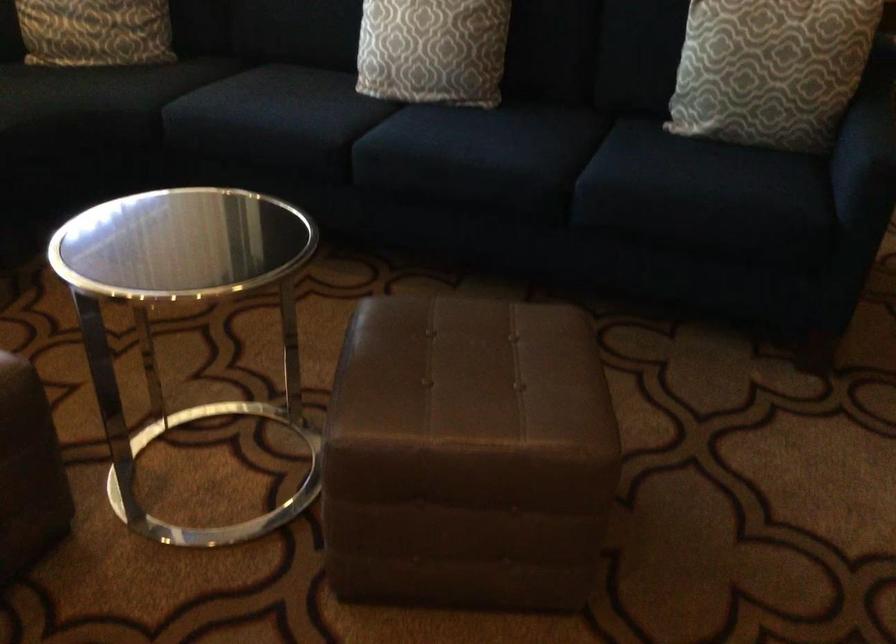
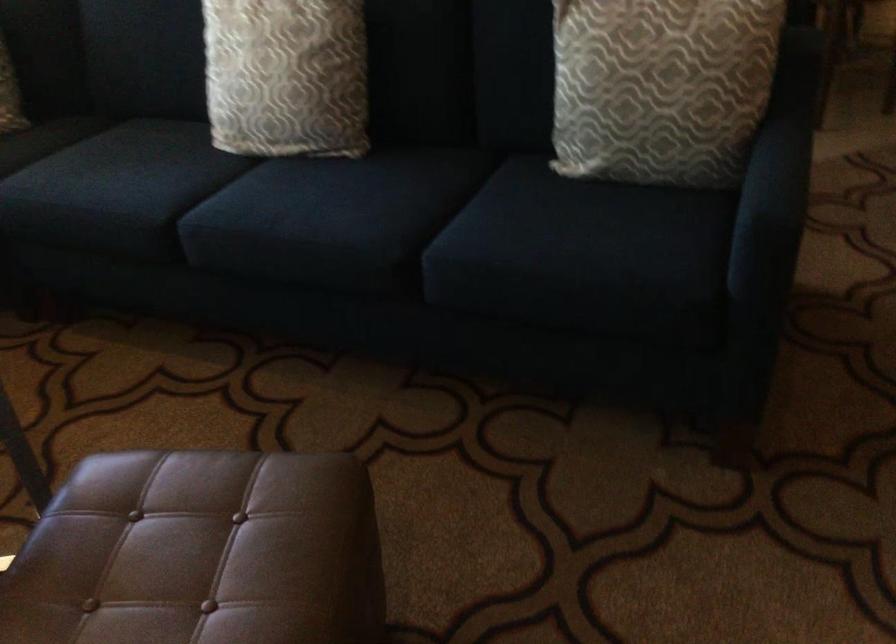
Question: How did the camera likely rotate?

Choices:
 (A) Left
 (B) Right
 (C) Up
 (D) Down

Answer: (A)